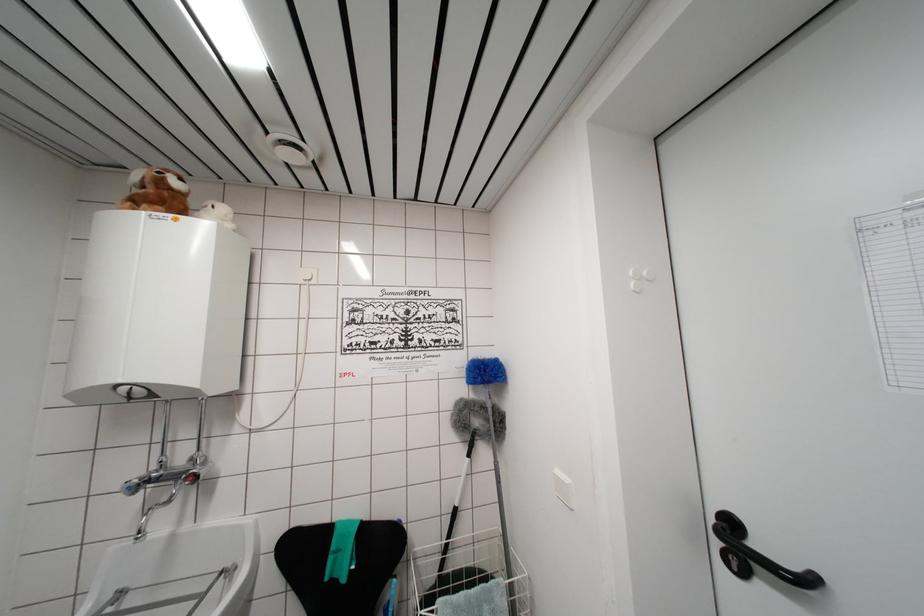
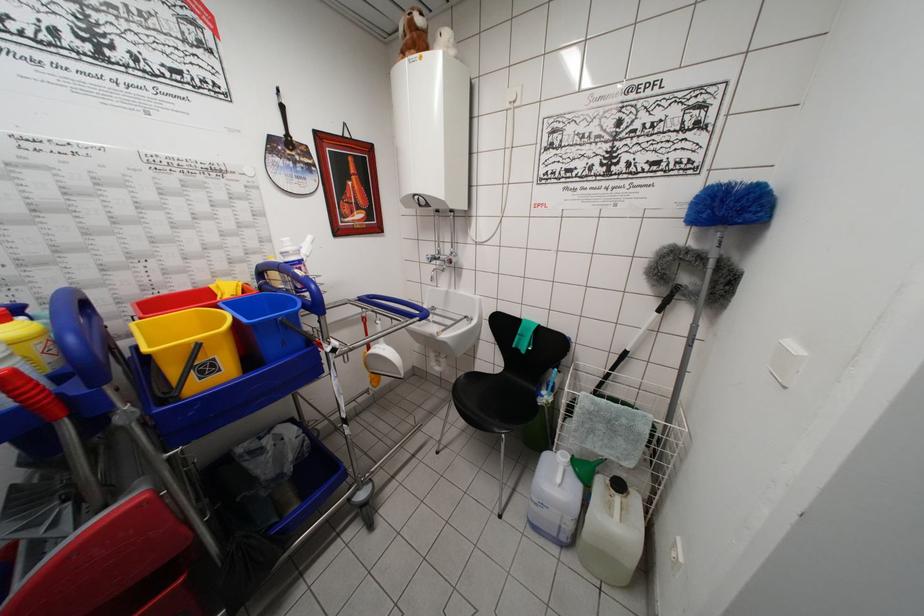
Find the pixel in the second image that matches (x=484, y=371) in the first image.

(723, 199)